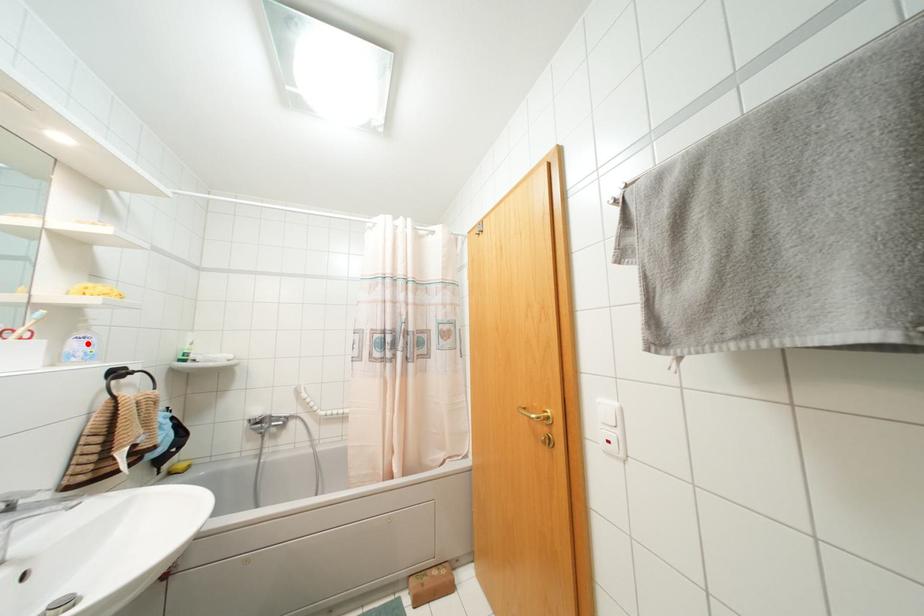
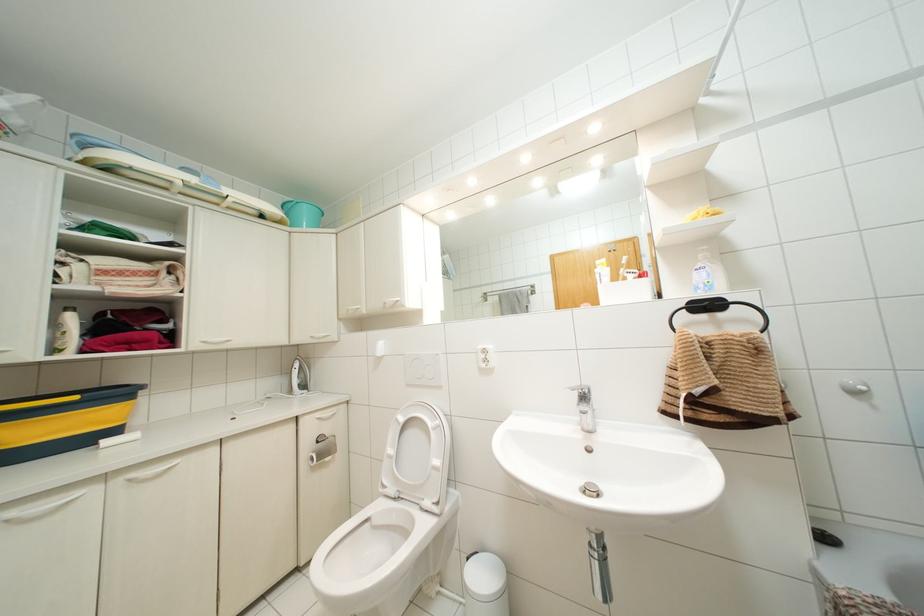
Locate, in the second image, the point that corresponds to the highlighted location in the first image.

(703, 274)